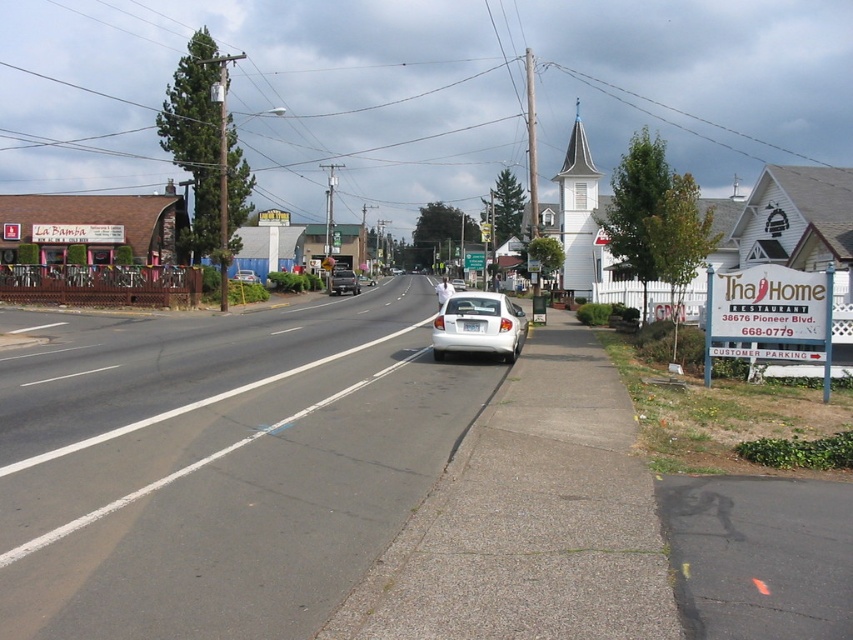
You are a delivery person trying to find the address of La Bamba. You see a white plastic sign at right and a white matte sedan at center. Which object is smaller in size?

The white plastic sign at right is smaller in size compared to the white matte sedan at center.

A pedestrian is standing at point (334, 289) and wants to cross the road to reach the sidewalk on the opposite side. The road has a width of 60.94 meters. Is the pedestrian able to cross the road safely within 2 minutes if they walk at a speed of 1.2 meters per second?

The pedestrian needs to cross 60.94 meters at 1.2 mps, which would take 60.94 divided by 1.2 equals approximately 50.78 seconds. Since 50.78 seconds is less than 120 seconds, the pedestrian can cross safely within 2 minutes.